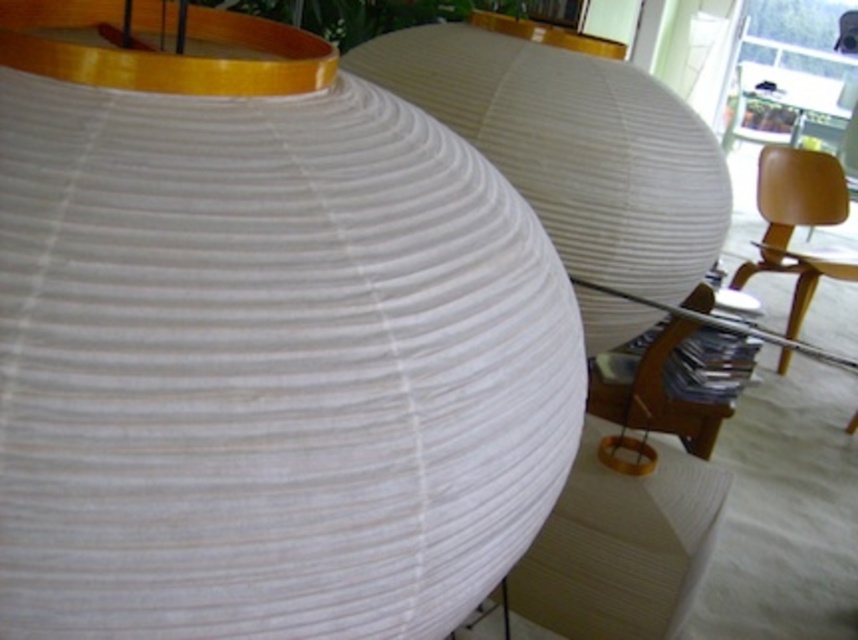
Question: Is white paper lantern at center smaller than white ribbed paper lantern at center?

Choices:
 (A) yes
 (B) no

Answer: (A)

Question: Among these points, which one is nearest to the camera?

Choices:
 (A) (680, 490)
 (B) (523, 342)

Answer: (B)

Question: Estimate the real-world distances between objects in this image. Which object is closer to the white ribbed paper lantern at center?

Choices:
 (A) white paper table at lower right
 (B) matte yellow chair at right

Answer: (A)

Question: Based on their relative distances, which object is farther from the matte yellow chair at right?

Choices:
 (A) white paper table at lower right
 (B) white paper lantern at center
 (C) white ribbed paper lantern at center

Answer: (B)

Question: Does white ribbed paper lantern at center come behind matte yellow chair at right?

Choices:
 (A) no
 (B) yes

Answer: (A)

Question: Is white paper lantern at center further to the viewer compared to matte yellow chair at right?

Choices:
 (A) no
 (B) yes

Answer: (A)